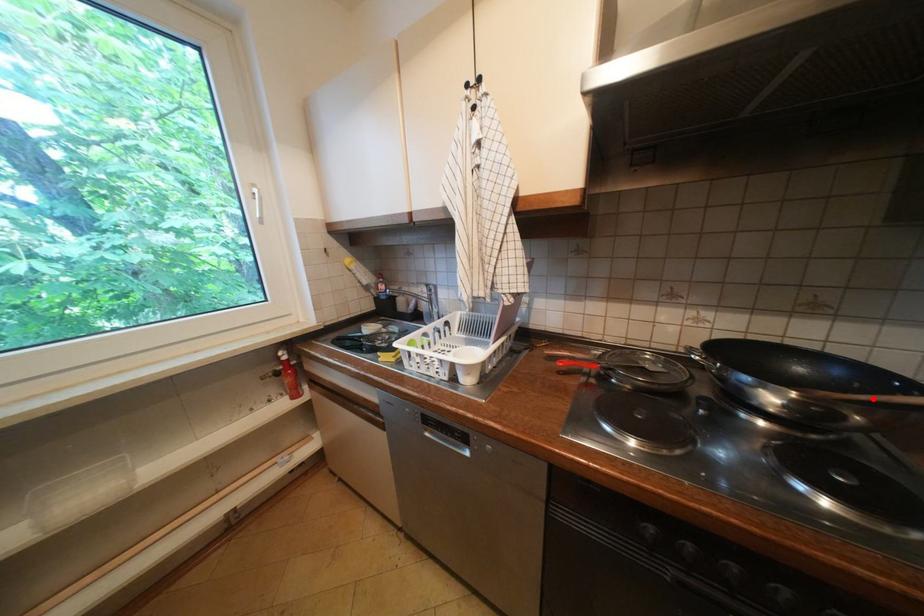
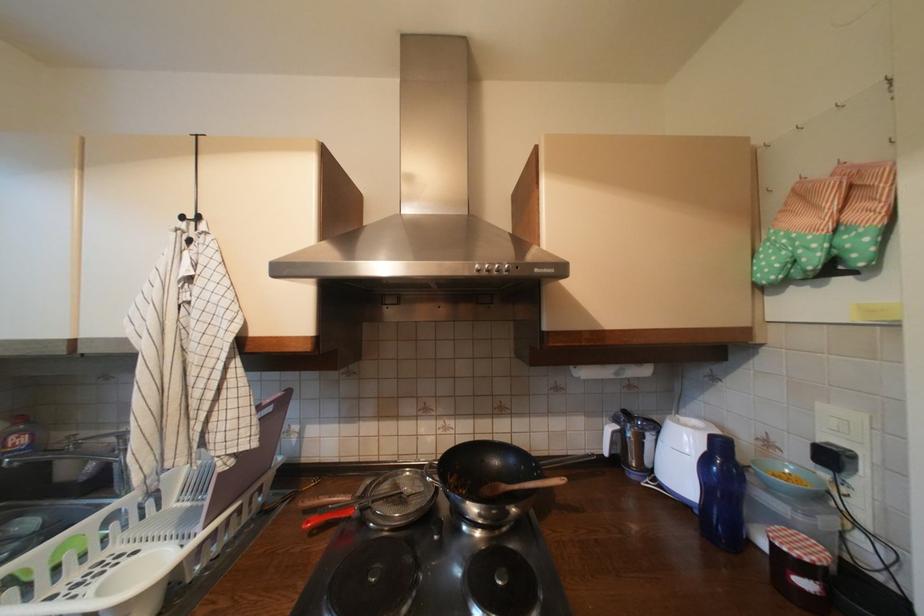
In the second image, find the point that corresponds to the highlighted location in the first image.

(525, 488)